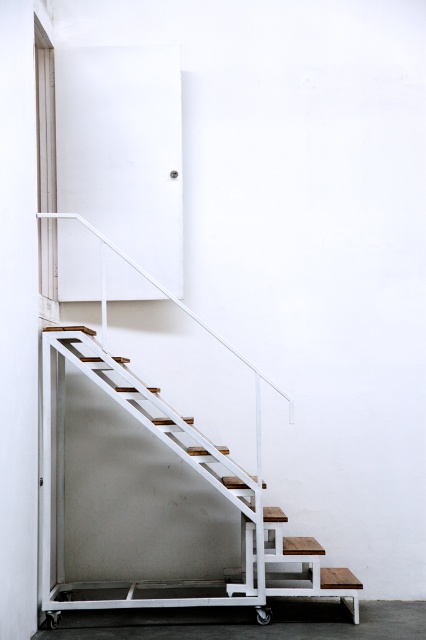
You are standing at the origin point of the room and want to reach the wooden stairs at center. According to the coordinates provided, in which direction should you move to reach them?

The wooden stairs at center are located at coordinates point (193, 468), so you should move towards the right and forward to reach them.

Consider the image. You are standing at the bottom of the wooden stairs at center and want to reach the black rubber wheel at lower center. Which direction should you move to get closer to the wheel?

Since the wooden stairs at center is closer to the viewer than the black rubber wheel at lower center, you should move forward away from the stairs towards the lower center direction to get closer to the black rubber wheel at lower center.